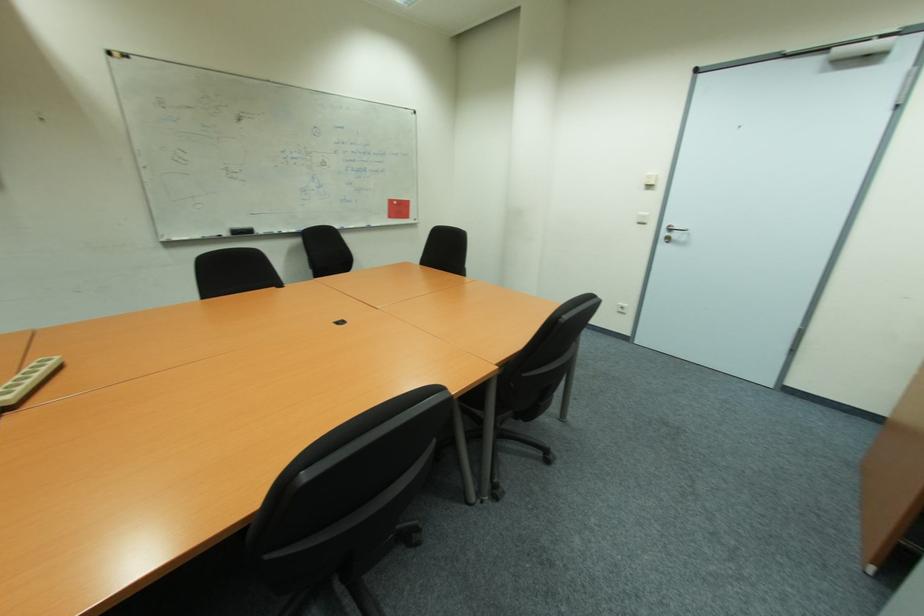
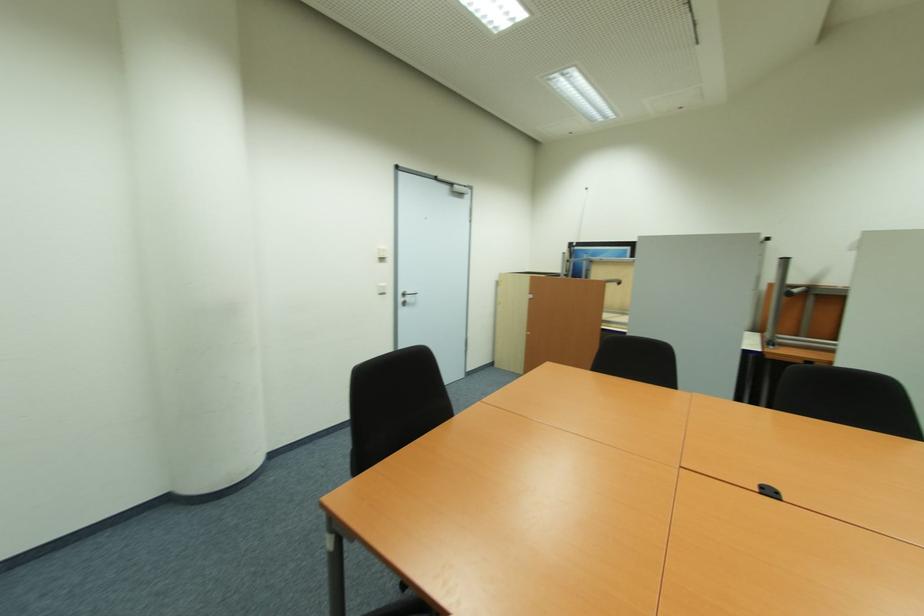
The point at (641, 224) is marked in the first image. Where is the corresponding point in the second image?

(383, 294)